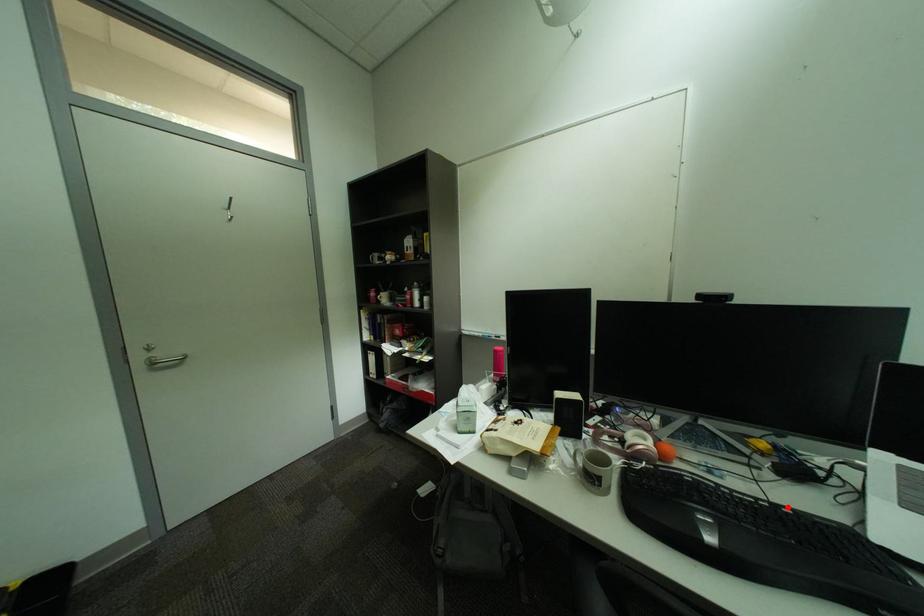
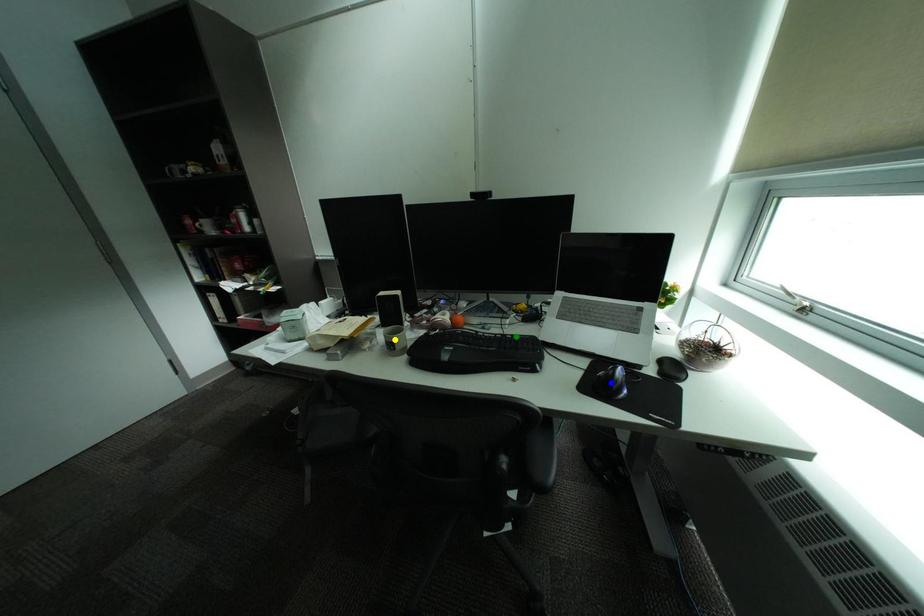
Question: I am providing you with two images of the same scene from different viewpoints. A red point is marked on the first image. You are given multiple points on the second image. Can you choose the point in image 2 that corresponds to the point in image 1?

Choices:
 (A) blue point
 (B) green point
 (C) yellow point

Answer: (B)